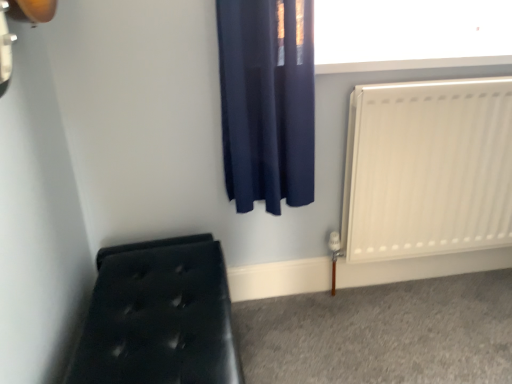
This screenshot has height=384, width=512. Find the location of `vacant space situated on the left part of white matte radiator at right`. vacant space situated on the left part of white matte radiator at right is located at coordinates (324, 329).